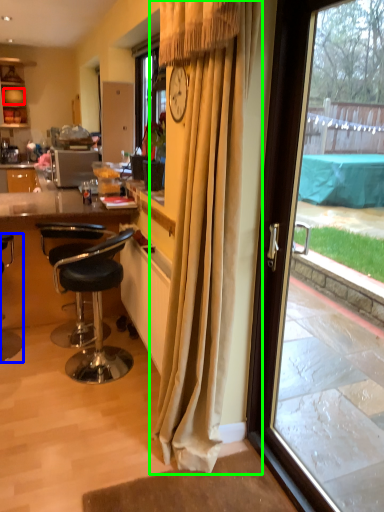
Question: Estimate the real-world distances between objects in this image. Which object is closer to plate (highlighted by a red box), chair (highlighted by a blue box) or curtain (highlighted by a green box)?

Choices:
 (A) chair
 (B) curtain

Answer: (A)